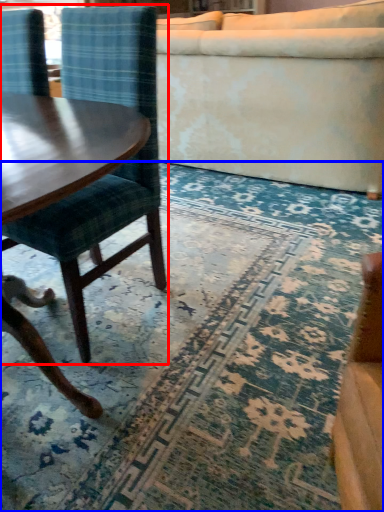
Question: Which object is further to the camera taking this photo, chair (highlighted by a red box) or mat (highlighted by a blue box)?

Choices:
 (A) chair
 (B) mat

Answer: (A)